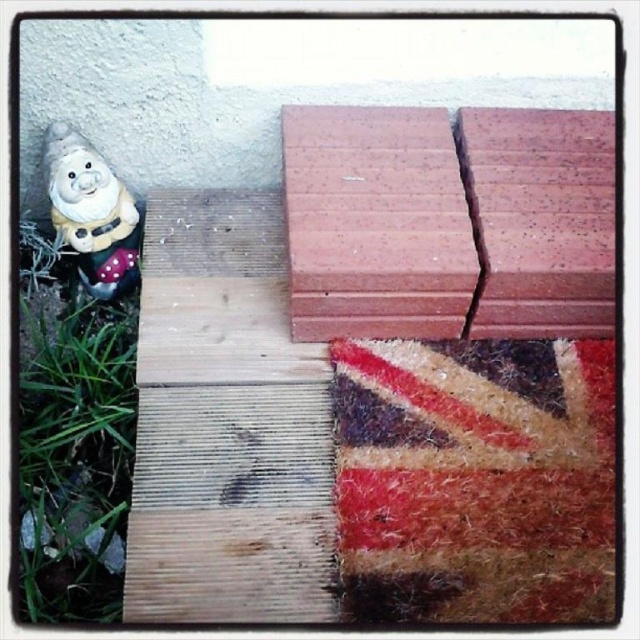
You are standing in the garden and notice two points marked in the image. Which point, point (484, 184) or point (42, 337), is closer to you?

Point (484, 184) is closer to you than point (42, 337).

You are a gardener who needs to move the gnome to a new location. The gnome is at point (x=29, y=456). You want to place it exactly halfway between the two wooden planks. Can you do that?

The two wooden planks are 1.35 meters apart. Half of that distance is 0.675 meters. So, moving the gnome to a position 0.675 meters from each plank would place it exactly halfway between them.

You are standing in the garden looking at the gnome and the two wooden planks. If you were to draw a straight line from your current position to the gnome, would the point at coordinates point (497, 316) and point (102, 163) be in front of or behind the gnome?

The point at coordinates point (497, 316) is closer to the camera than point (102, 163). Therefore, the point at point (497, 316) would be in front of the gnome, while the point at point (102, 163) would be behind the gnome.